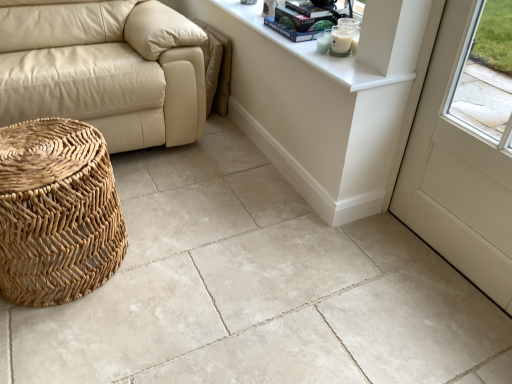
Locate an element on the screen. vacant area that is situated to the right of natural woven basket at lower left is located at coordinates (175, 268).